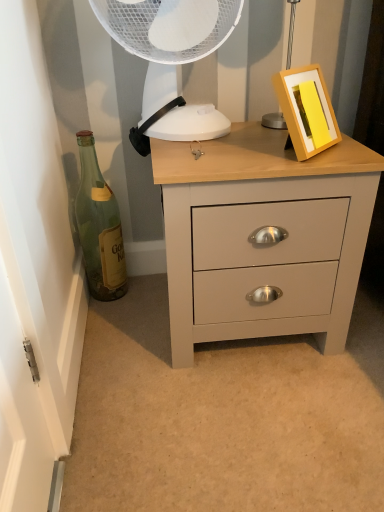
Find the location of a particular element. The width and height of the screenshot is (384, 512). free point to the right of green glass bottle at left is located at coordinates (145, 296).